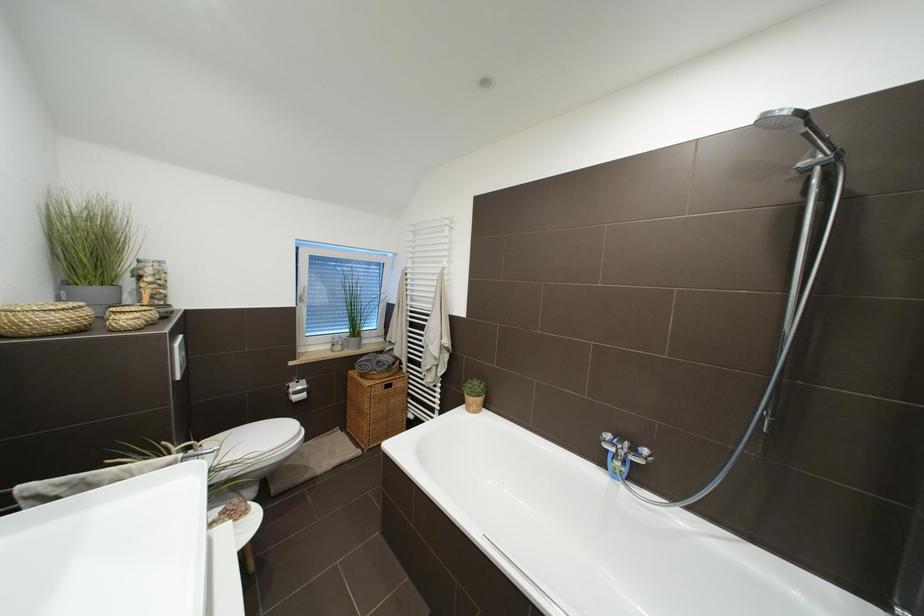
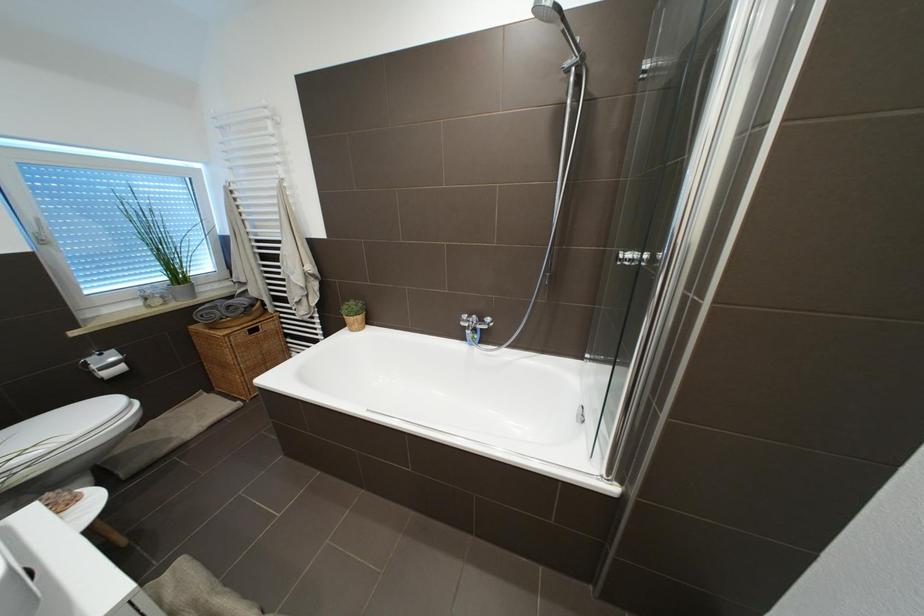
Which direction would the cameraman need to move to produce the second image?

The cameraman moved toward right, backward.